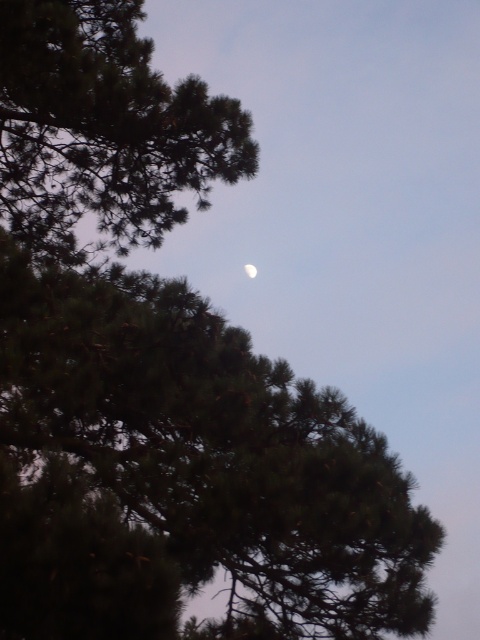
Where is `green matte tree at upper left`? The width and height of the screenshot is (480, 640). green matte tree at upper left is located at coordinates point(103,129).

What do you see at coordinates (103, 129) in the screenshot? I see `green matte tree at upper left` at bounding box center [103, 129].

At what (x,y) coordinates should I click in order to perform the action: click on green matte tree at upper left. Please return your answer as a coordinate pair (x, y). This screenshot has height=640, width=480. Looking at the image, I should click on (103, 129).

Is green needle-like leaves at upper left below white glossy moon at upper center?

Yes.

Is green needle-like leaves at upper left wider than white glossy moon at upper center?

Indeed, green needle-like leaves at upper left has a greater width compared to white glossy moon at upper center.

Which is behind, point (33, 564) or point (255, 275)?

The point (255, 275) is more distant.

What are the coordinates of `green needle-like leaves at upper left` in the screenshot? It's located at click(x=184, y=474).

Between green needle-like leaves at upper left and green matte tree at upper left, which one has less height?

With less height is green matte tree at upper left.

Is green needle-like leaves at upper left bigger than green matte tree at upper left?

Indeed, green needle-like leaves at upper left has a larger size compared to green matte tree at upper left.

Who is more forward, (79, 285) or (52, 198)?

Point (79, 285)

In order to click on green needle-like leaves at upper left in this screenshot , I will do `click(184, 474)`.